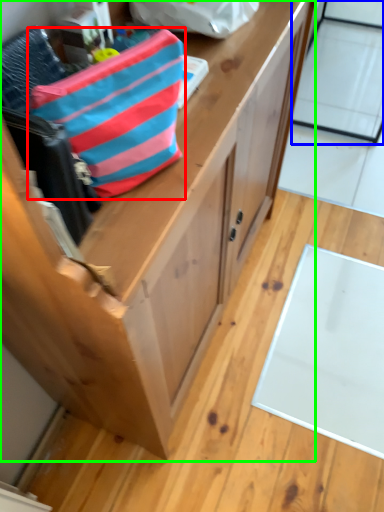
Question: Which is nearer to the pouch (highlighted by a red box)? glass door (highlighted by a blue box) or cabinetry (highlighted by a green box).

Choices:
 (A) glass door
 (B) cabinetry

Answer: (B)